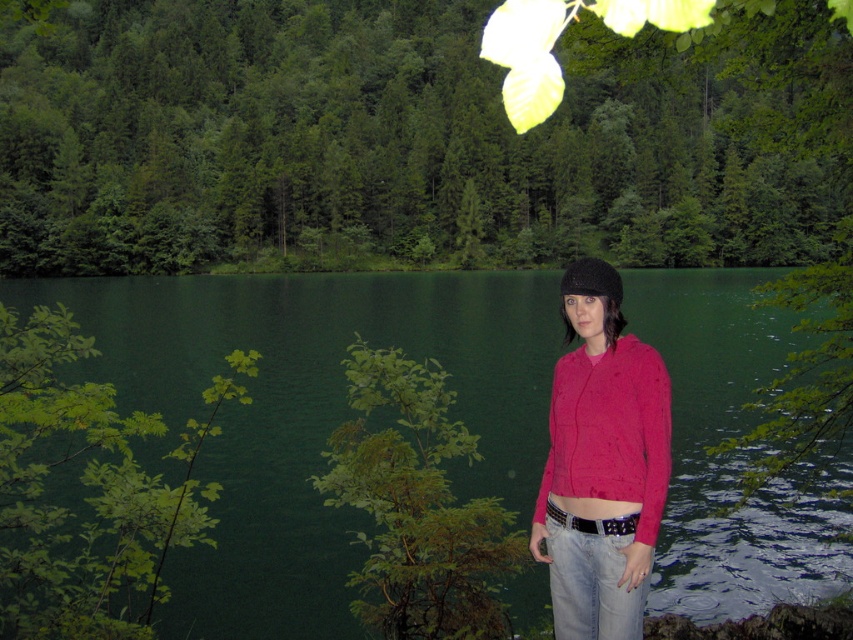
Can you confirm if green leafy tree at upper center is wider than green leafy branch at left?

Yes.

Is point (171, 0) behind point (103, 544)?

Yes.

What are the coordinates of `green leafy tree at upper center` in the screenshot? It's located at tap(412, 138).

Find the location of `green leafy tree at upper center`. green leafy tree at upper center is located at coordinates tap(412, 138).

Does point (358, 182) come closer to viewer compared to point (196, 291)?

No, it is not.

Between green leafy tree at upper center and green liquid water at center, which one has less height?

green liquid water at center

This screenshot has height=640, width=853. What do you see at coordinates (412, 138) in the screenshot?
I see `green leafy tree at upper center` at bounding box center [412, 138].

Identify the location of green leafy tree at upper center. The height and width of the screenshot is (640, 853). (412, 138).

Between green leafy bush at lower left and black fuzzy hat at center, which one has more height?

green leafy bush at lower left

The image size is (853, 640). Find the location of `green leafy bush at lower left`. green leafy bush at lower left is located at coordinates (416, 506).